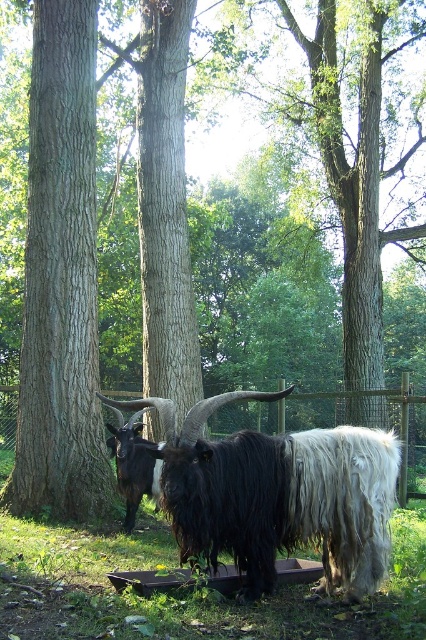
Question: Which object appears farthest from the camera in this image?

Choices:
 (A) metal wire fence at center
 (B) brown rough tree trunk at center

Answer: (A)

Question: Which of the following is the closest to the observer?

Choices:
 (A) (376, 570)
 (B) (108, 470)
 (C) (123, 468)
 (D) (331, 397)

Answer: (A)

Question: Does brown rough tree trunk at center appear over black woolly goat at center?

Choices:
 (A) yes
 (B) no

Answer: (A)

Question: Can you confirm if black woolly goat at center is positioned to the left of dark brown fur goat at left?

Choices:
 (A) no
 (B) yes

Answer: (A)

Question: Does brown rough tree trunk at center appear on the right side of metal wire fence at center?

Choices:
 (A) yes
 (B) no

Answer: (B)

Question: Which object is closer to the camera taking this photo?

Choices:
 (A) metal wire fence at center
 (B) black woolly goat at center

Answer: (B)